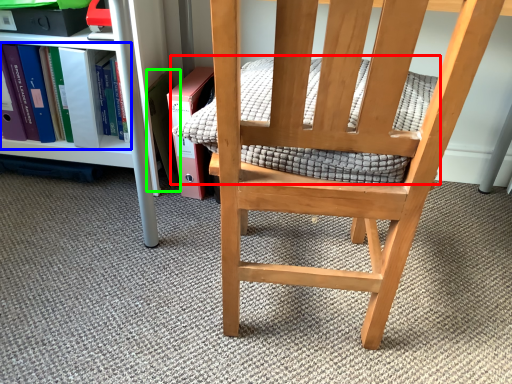
Question: Based on their relative distances, which object is farther from quilt (highlighted by a red box)? Choose from book (highlighted by a blue box) and paperback book (highlighted by a green box).

Choices:
 (A) book
 (B) paperback book

Answer: (A)